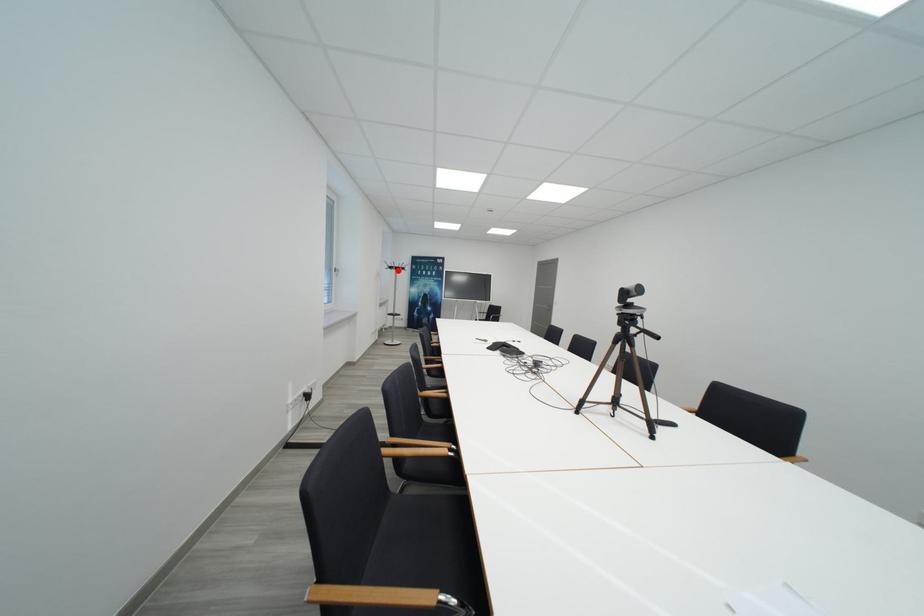
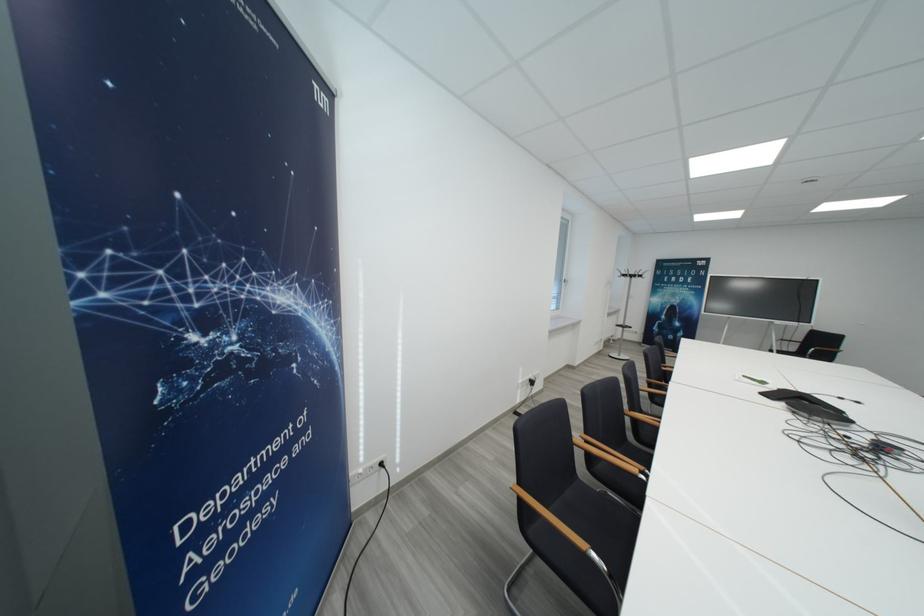
Locate, in the second image, the point that corresponds to the highlighted location in the first image.

(631, 278)